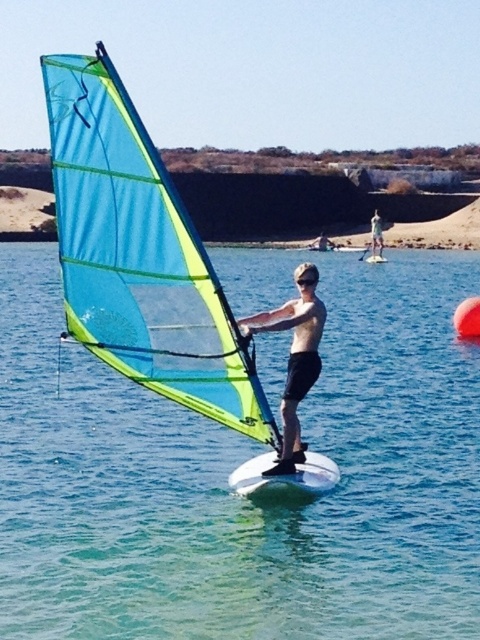
Question: Can you confirm if transparent plastic sail at center is positioned to the right of translucent blue sail at center?

Choices:
 (A) yes
 (B) no

Answer: (A)

Question: Among these points, which one is nearest to the camera?

Choices:
 (A) (292, 275)
 (B) (288, 490)

Answer: (B)

Question: Which object is the farthest from the white glossy surfboard at center?

Choices:
 (A) transparent plastic sail at center
 (B) white foam surfboard at center
 (C) matte green sail at center
 (D) translucent blue sail at center

Answer: (B)

Question: Considering the real-world distances, which object is closest to the white glossy surfboard at center?

Choices:
 (A) white foam surfboard at center
 (B) transparent plastic sail at center

Answer: (B)

Question: Is transparent plastic sail at center below white glossy surfboard at center?

Choices:
 (A) yes
 (B) no

Answer: (B)

Question: Is translucent blue sail at center smaller than matte green sail at center?

Choices:
 (A) no
 (B) yes

Answer: (B)